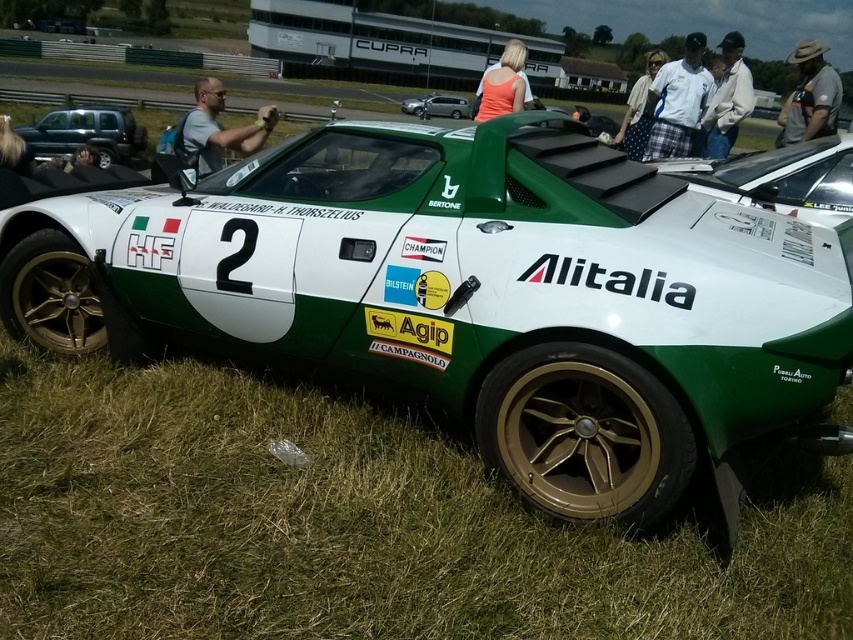
Question: Which object is the closest to the plaid fabric skirt at center?

Choices:
 (A) green matte truck at left
 (B) green matte sports car at center
 (C) matte gray shirt at upper center

Answer: (B)

Question: Which object is farther from the camera taking this photo?

Choices:
 (A) matte gray shirt at upper center
 (B) khaki fabric shirt at upper right
 (C) plaid fabric skirt at center

Answer: (C)

Question: Which point is closer to the camera?

Choices:
 (A) (577, 120)
 (B) (404, 109)
 (C) (196, 109)
 (D) (627, 124)

Answer: (A)

Question: Can you confirm if khaki fabric shirt at upper right is positioned to the left of matte black car at center?

Choices:
 (A) yes
 (B) no

Answer: (B)

Question: From the image, what is the correct spatial relationship of green grass at lower left in relation to orange fabric top at upper center?

Choices:
 (A) right
 (B) left

Answer: (B)

Question: Can you confirm if green grass at lower left is positioned to the right of khaki fabric shirt at upper right?

Choices:
 (A) no
 (B) yes

Answer: (A)